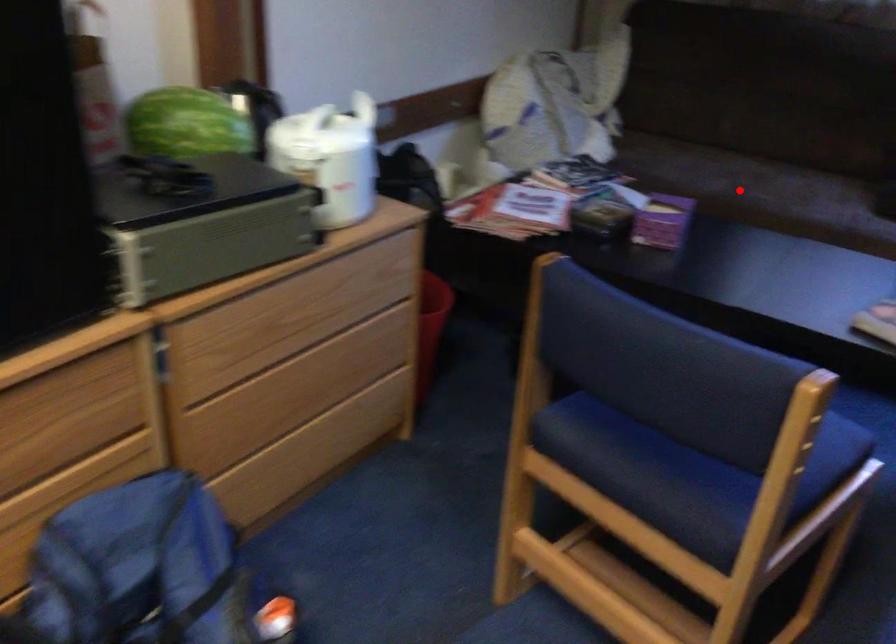
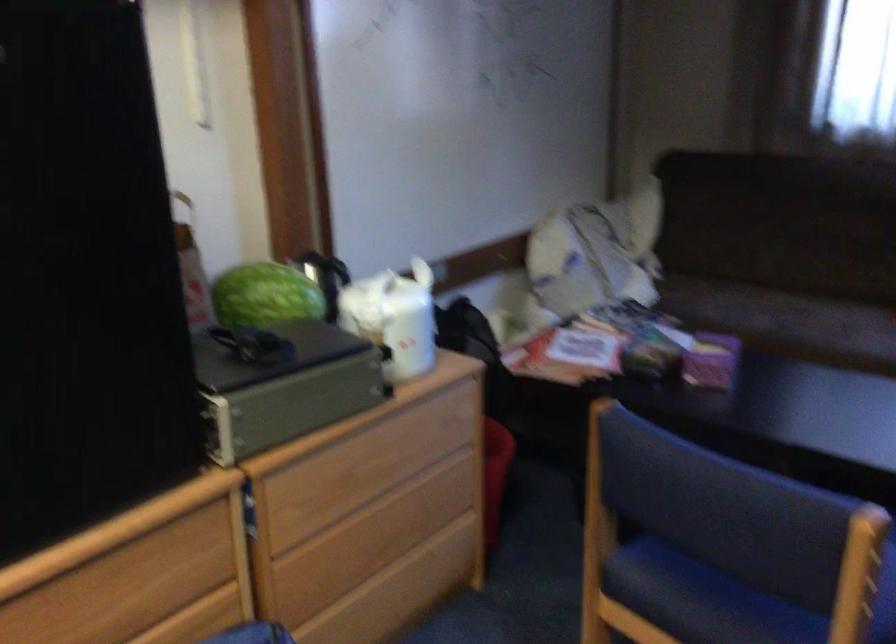
In the second image, find the point that corresponds to the highlighted location in the first image.

(787, 322)